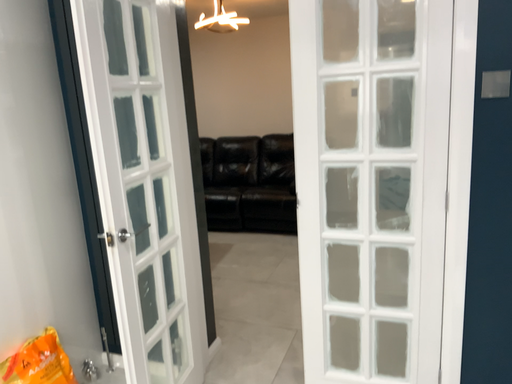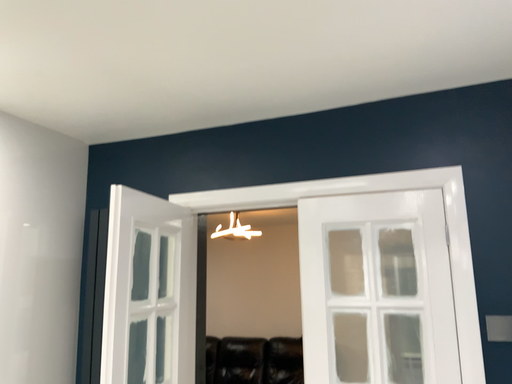
Question: How did the camera likely rotate when shooting the video?

Choices:
 (A) rotated upward
 (B) rotated downward

Answer: (A)